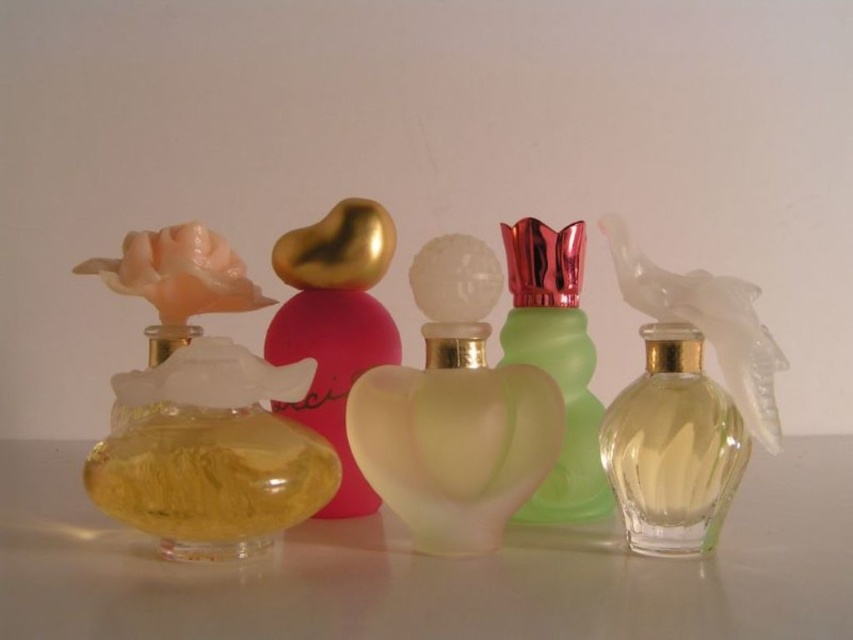
Question: Considering the real-world distances, which object is farthest from the green frosted glass perfume at center?

Choices:
 (A) satin white heart-shaped perfume at center
 (B) translucent yellow glass at left
 (C) transparent glass perfume bottles at center

Answer: (B)

Question: Which object is positioned closest to the translucent yellow glass at left?

Choices:
 (A) translucent yellow liquid at left
 (B) clear glass perfume at center right
 (C) gold metallic heart at center
 (D) satin white heart-shaped perfume at center

Answer: (A)

Question: Which point is farther to the camera?

Choices:
 (A) clear glass perfume at center right
 (B) transparent glass perfume bottles at center
 (C) green frosted glass perfume at center
 (D) satin white heart-shaped perfume at center

Answer: (C)

Question: Does satin white heart-shaped perfume at center appear under clear glass perfume at center right?

Choices:
 (A) yes
 (B) no

Answer: (A)

Question: Does translucent yellow glass at left have a lesser width compared to gold metallic heart at center?

Choices:
 (A) yes
 (B) no

Answer: (B)

Question: Is clear glass perfume at center right behind green frosted glass perfume at center?

Choices:
 (A) yes
 (B) no

Answer: (B)